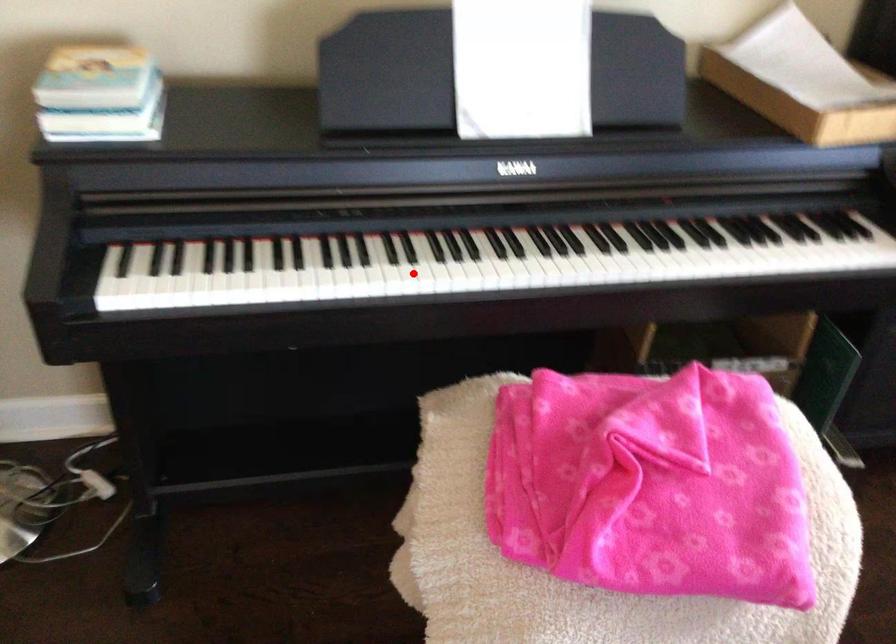
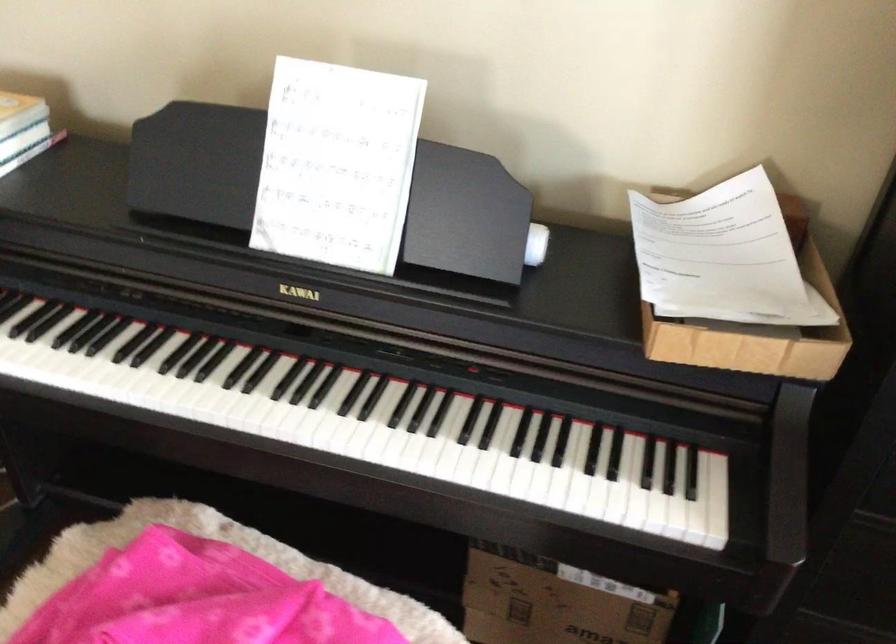
Find the pixel in the second image that matches the highlighted location in the first image.

(116, 382)